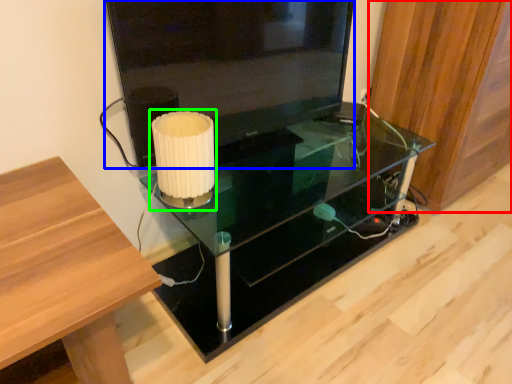
Question: Which object is the closest to the wood (highlighted by a red box)? Choose among these: television (highlighted by a blue box) or table lamp (highlighted by a green box).

Choices:
 (A) television
 (B) table lamp

Answer: (A)